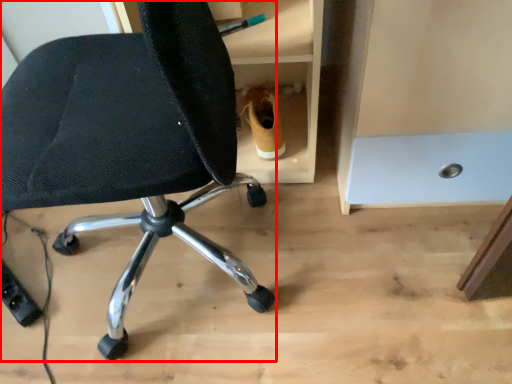
Question: From the image's perspective, where is chair (annotated by the red box) located relative to footwear?

Choices:
 (A) above
 (B) below

Answer: (B)